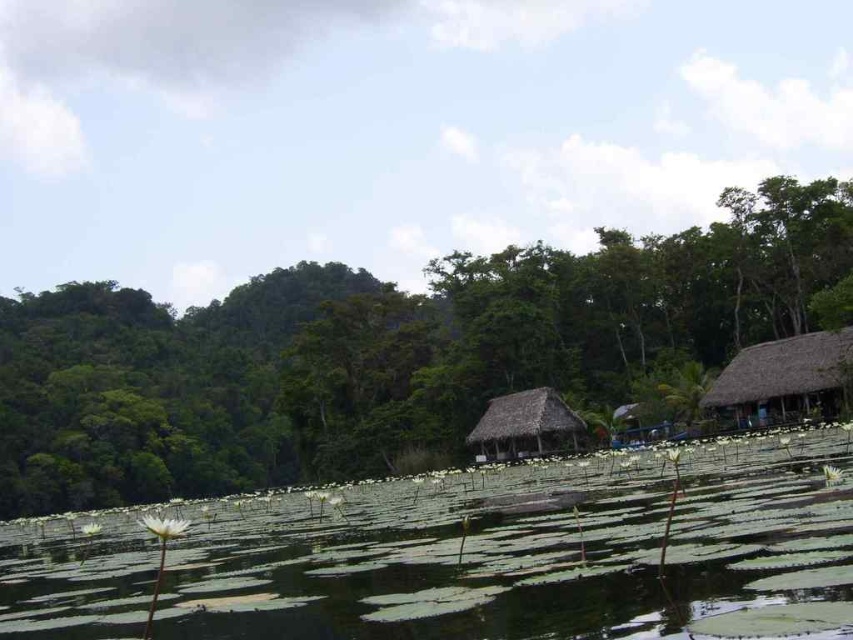
You are standing in the serene natural scene and want to place a small decorative stone. You have two options for placement locations marked as point (x=579, y=564) and point (x=547, y=433). Which point is closer to you so that the stone will be more visible to visitors entering the scene?

Point (x=579, y=564) is closer to the camera than point (x=547, y=433), so placing the stone there would make it more visible to visitors entering the scene.

You are a visitor in this serene natural setting. You want to take a photo of both the green leafy water at center and the thatched straw hut at center. Which one should you focus on first if you want to capture both in a single frame without moving the camera?

You should focus on the green leafy water at center first because it is larger than the thatched straw hut at center, so it will take up more space in the frame.